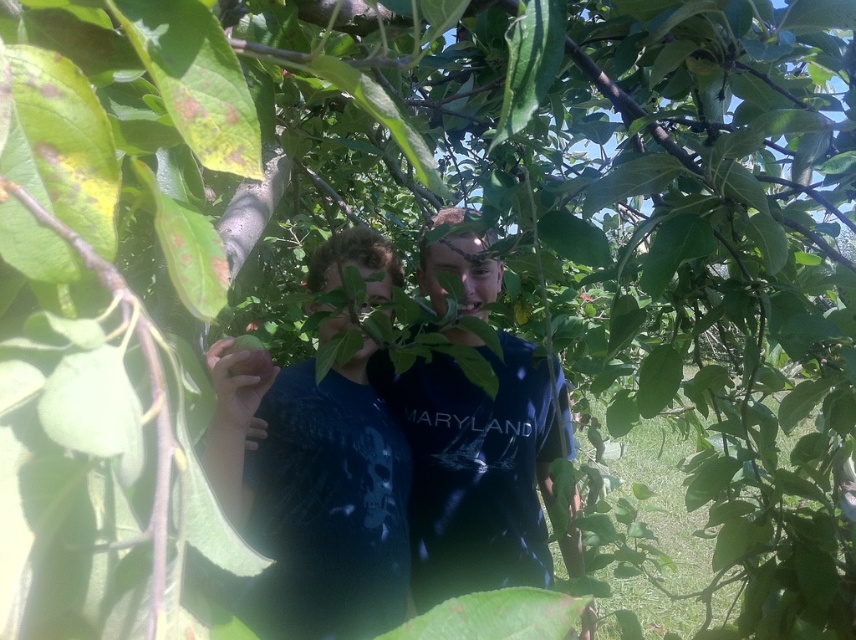
Between matte blue t-shirt at center and green matte apple at center, which one is positioned lower?

Positioned lower is matte blue t-shirt at center.

Measure the distance between matte blue t-shirt at center and camera.

matte blue t-shirt at center is 3.46 feet away from camera.

The image size is (856, 640). I want to click on matte blue t-shirt at center, so (319, 451).